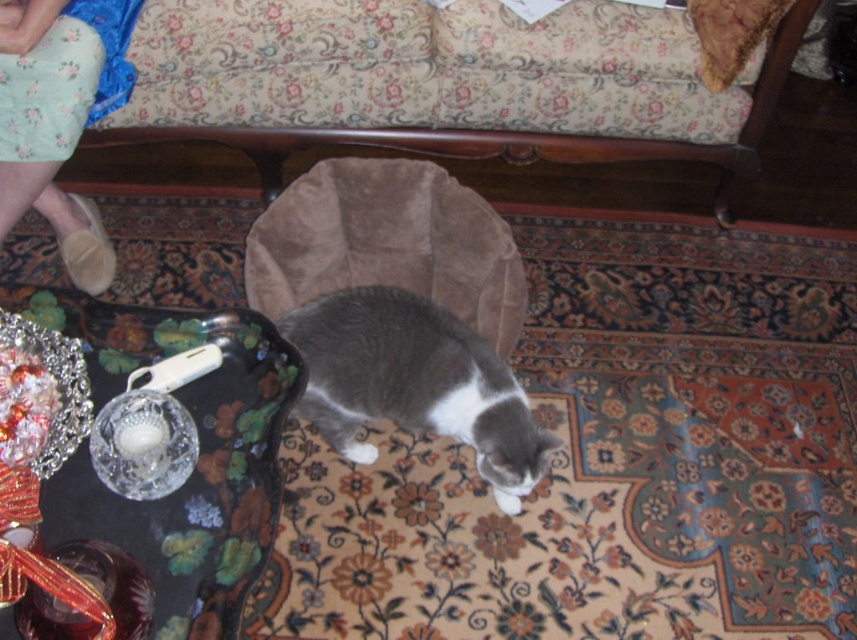
Is suede couch at center closer to the viewer compared to velvet cushion at upper right?

No, it is behind velvet cushion at upper right.

Which is more to the right, suede couch at center or velvet cushion at upper right?

Positioned to the right is velvet cushion at upper right.

Measure the distance between suede couch at center and camera.

suede couch at center and camera are 5.34 feet apart.

Locate an element on the screen. suede couch at center is located at coordinates (508, 132).

In the scene shown: Does gray soft fur cat at center appear under suede couch at center?

Correct, gray soft fur cat at center is located below suede couch at center.

Who is lower down, gray soft fur cat at center or suede couch at center?

gray soft fur cat at center

Is point (315, 356) positioned in front of point (94, 138)?

Yes, it is.

You are a GUI agent. You are given a task and a screenshot of the screen. Output one action in this format:
    pyautogui.click(x=<x>, y=<y>)
    Task: Click on the gray soft fur cat at center
    Image resolution: width=857 pixels, height=640 pixels.
    Given the screenshot: What is the action you would take?
    pyautogui.click(x=414, y=381)

Which is more to the left, suede cat bed at center or suede couch at center?

suede cat bed at center

Which is in front, point (517, 268) or point (285, 156)?

Point (517, 268)

Image resolution: width=857 pixels, height=640 pixels. I want to click on suede cat bed at center, so click(x=387, y=243).